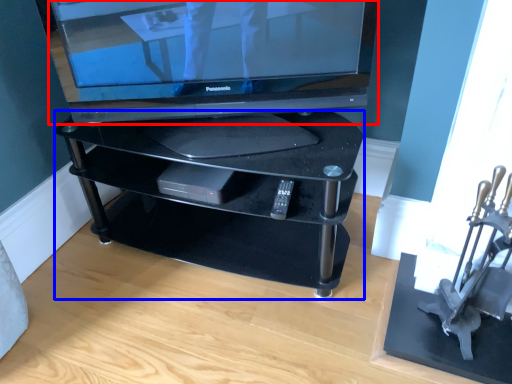
Question: Among these objects, which one is farthest to the camera, television (highlighted by a red box) or furniture (highlighted by a blue box)?

Choices:
 (A) television
 (B) furniture

Answer: (B)